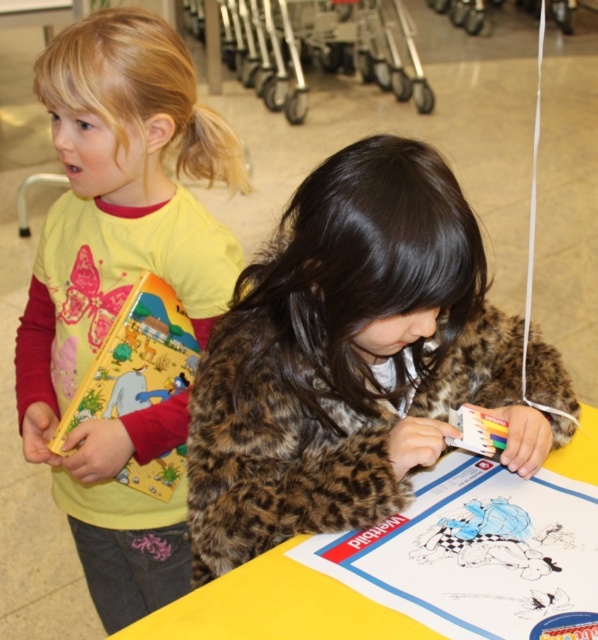
Does leopard print jacket at center have a lesser width compared to matte yellow shirt at left?

Incorrect, leopard print jacket at center's width is not less than matte yellow shirt at left's.

Between point (215, 380) and point (185, 209), which one is positioned in front?

Point (215, 380) is in front.

Where is `leopard print jacket at center`? This screenshot has width=598, height=640. leopard print jacket at center is located at coordinates (356, 358).

Between leopard print jacket at center and yellow paper at center, which one has less height?

yellow paper at center

Consider the image. Can you confirm if leopard print jacket at center is taller than yellow paper at center?

Yes.

The width and height of the screenshot is (598, 640). What are the coordinates of `leopard print jacket at center` in the screenshot? It's located at (356, 358).

Is matte yellow shirt at left positioned before yellow paper at center?

No.

In the scene shown: Who is higher up, matte yellow shirt at left or yellow paper at center?

matte yellow shirt at left is higher up.

You are a GUI agent. You are given a task and a screenshot of the screen. Output one action in this format:
    pyautogui.click(x=<x>, y=<y>)
    Task: Click on the matte yellow shirt at left
    
    Given the screenshot: What is the action you would take?
    pyautogui.click(x=120, y=285)

Where is `matte yellow shirt at left`? The width and height of the screenshot is (598, 640). matte yellow shirt at left is located at coordinates (120, 285).